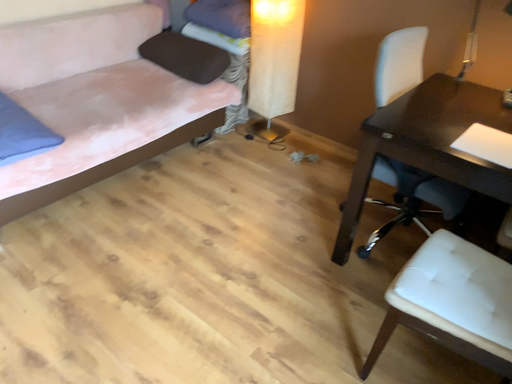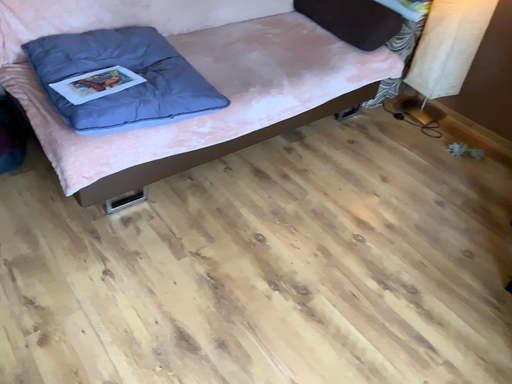
Question: Which way did the camera rotate in the video?

Choices:
 (A) rotated left
 (B) rotated right

Answer: (A)